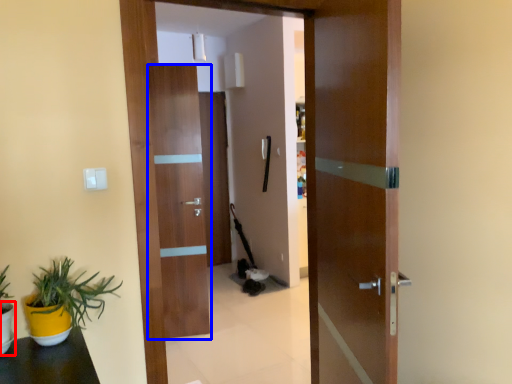
Question: Which point is closer to the camera, flowerpot (highlighted by a red box) or door (highlighted by a blue box)?

Choices:
 (A) flowerpot
 (B) door

Answer: (A)